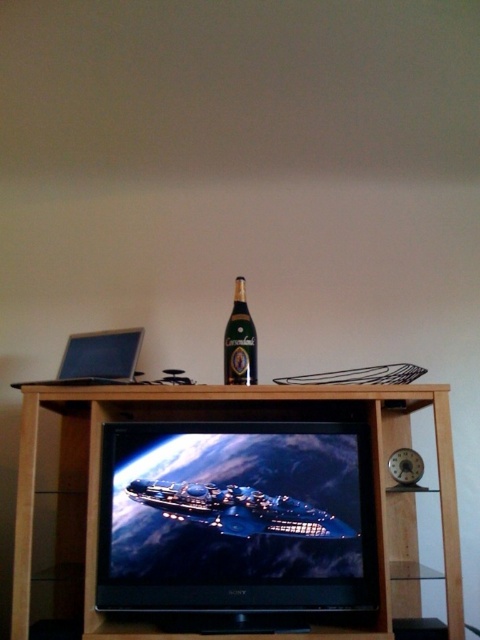
Looking at this image, you are setting up a desk and need to place a matte black laptop at left and a black glossy flat screen tv at center. The desk has limited vertical space. Which item should you prioritize placing first to ensure both fit vertically?

The black glossy flat screen tv at center is taller than the matte black laptop at left, so you should prioritize placing the black glossy flat screen tv at center first to ensure both fit vertically.

You are standing in front of a wooden entertainment unit. There is a point marked at coordinates (452, 513) on the unit. If you want to place a 6 feet long decorative rod horizontally on the entertainment unit, will it fit from the edge closest to you to the point?

The distance between the point at (452, 513) and the camera is 5.70 feet. Since the rod is 6 feet long, it will not fit as the distance is shorter than the rod.

You are trying to place a new speaker system that requires 1.5 square feet of space. You have two options on the entertainment unit where the black glossy flat screen tv at center and the black wood entertainment center at center are located. Which one can accommodate the speaker system based on their size?

The black wood entertainment center at center occupies more space than the black glossy flat screen tv at center. Therefore, the speaker system requiring 1.5 square feet can be placed on the black wood entertainment center at center since it has more available space.